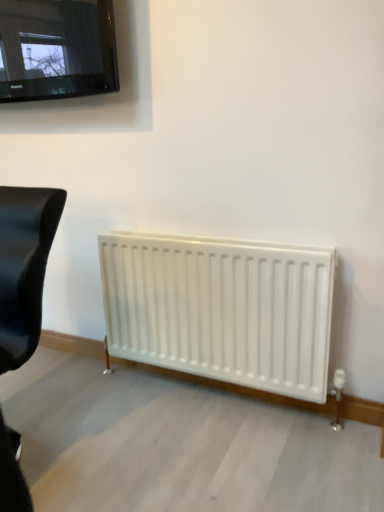
Measure the distance between point (58,47) and camera.

Point (58,47) and camera are 14.35 feet apart.

At what (x,y) coordinates should I click in order to perform the action: click on black glossy television at upper left. Please return your answer as a coordinate pair (x, y). The image size is (384, 512). Looking at the image, I should click on (56, 49).

The height and width of the screenshot is (512, 384). Describe the element at coordinates (56, 49) in the screenshot. I see `black glossy television at upper left` at that location.

Image resolution: width=384 pixels, height=512 pixels. Describe the element at coordinates (24, 267) in the screenshot. I see `black leather chair at left` at that location.

Locate an element on the screen. The height and width of the screenshot is (512, 384). black leather chair at left is located at coordinates (24, 267).

Where is `black glossy television at upper left`? This screenshot has width=384, height=512. black glossy television at upper left is located at coordinates (56, 49).

Is black glossy television at upper left to the left of black leather chair at left from the viewer's perspective?

Incorrect, black glossy television at upper left is not on the left side of black leather chair at left.

In the image, is black glossy television at upper left positioned in front of or behind black leather chair at left?

In the image, black glossy television at upper left appears behind black leather chair at left.

Which is nearer, (x=2, y=9) or (x=35, y=297)?

Point (x=2, y=9).

From the picture: From the image's perspective, between black glossy television at upper left and black leather chair at left, which one is located above?

black glossy television at upper left, from the image's perspective.

From a real-world perspective, is black glossy television at upper left positioned over black leather chair at left based on gravity?

Yes.

Does black glossy television at upper left have a lesser width compared to black leather chair at left?

Yes, black glossy television at upper left is thinner than black leather chair at left.

Is black glossy television at upper left shorter than black leather chair at left?

Yes, black glossy television at upper left is shorter than black leather chair at left.

Which of these two, black glossy television at upper left or black leather chair at left, is smaller?

Smaller between the two is black glossy television at upper left.

Would you say black leather chair at left is part of black glossy television at upper left's contents?

No, black glossy television at upper left does not contain black leather chair at left.

Is black glossy television at upper left far away from black leather chair at left?

black glossy television at upper left is far away from black leather chair at left.

In the scene shown: Does black glossy television at upper left turn towards black leather chair at left?

No, black glossy television at upper left is not facing towards black leather chair at left.

Can you tell me how much black glossy television at upper left and black leather chair at left differ in facing direction?

There is a 7.75-degree angle between the facing directions of black glossy television at upper left and black leather chair at left.

At what (x,y) coordinates should I click in order to perform the action: click on furniture below the black glossy television at upper left (from the image's perspective). Please return your answer as a coordinate pair (x, y). Image resolution: width=384 pixels, height=512 pixels. Looking at the image, I should click on (24, 267).

Between black leather chair at left and black glossy television at upper left, which one appears on the right side from the viewer's perspective?

From the viewer's perspective, black glossy television at upper left appears more on the right side.

Relative to black glossy television at upper left, is black leather chair at left in front or behind?

black leather chair at left is positioned closer to the viewer than black glossy television at upper left.

Which is closer, (26,233) or (90,24)?

Point (26,233) is positioned closer to the camera compared to point (90,24).

Looking at this image, from the image's perspective, does black leather chair at left appear lower than black glossy television at upper left?

Correct, black leather chair at left appears lower than black glossy television at upper left in the image.

From a real-world perspective, which is physically above, black leather chair at left or black glossy television at upper left?

In real-world perspective, black glossy television at upper left is above.

Does black leather chair at left have a greater width compared to black glossy television at upper left?

Yes, black leather chair at left is wider than black glossy television at upper left.

In terms of height, does black leather chair at left look taller or shorter compared to black glossy television at upper left?

Clearly, black leather chair at left is taller compared to black glossy television at upper left.

Is black leather chair at left smaller than black glossy television at upper left?

Incorrect, black leather chair at left is not smaller in size than black glossy television at upper left.

From the picture: Choose the correct answer: Is black leather chair at left inside black glossy television at upper left or outside it?

black leather chair at left is spatially situated outside black glossy television at upper left.

Is black leather chair at left next to black glossy television at upper left?

There is a gap between black leather chair at left and black glossy television at upper left.

Is black leather chair at left turned away from black glossy television at upper left?

That's not correct — black leather chair at left is not looking away from black glossy television at upper left.

How many degrees apart are the facing directions of black leather chair at left and black glossy television at upper left?

They differ by 7.75 degrees in their facing directions.

In order to click on furniture on the left of black glossy television at upper left in this screenshot , I will do `click(24, 267)`.

Where is `furniture that appears below the black glossy television at upper left (from the image's perspective)`? This screenshot has width=384, height=512. furniture that appears below the black glossy television at upper left (from the image's perspective) is located at coordinates (24, 267).

The width and height of the screenshot is (384, 512). Find the location of `furniture below the black glossy television at upper left (from a real-world perspective)`. furniture below the black glossy television at upper left (from a real-world perspective) is located at coordinates (24, 267).